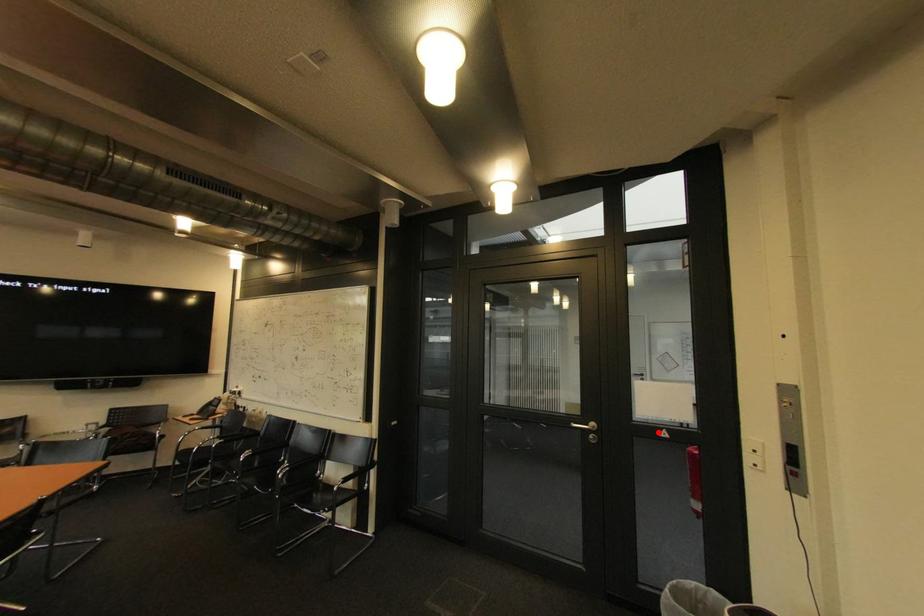
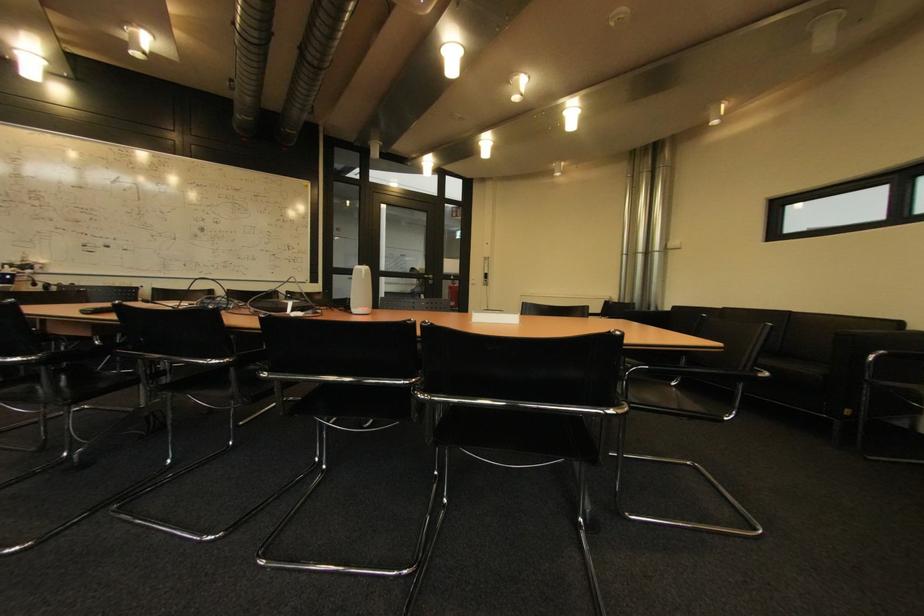
In the second image, find the point that corresponds to the highlighted location in the first image.

(456, 278)